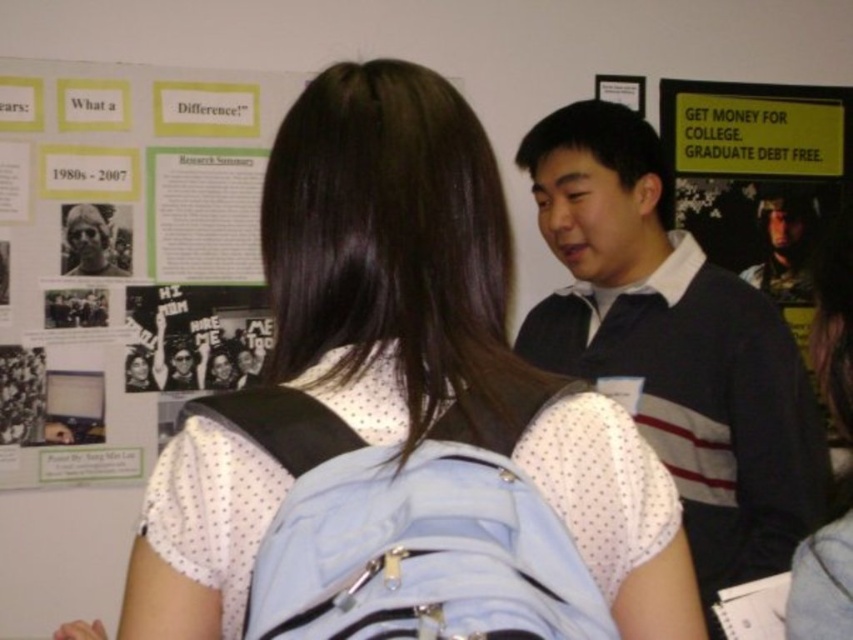
In the scene shown: Who is positioned more to the left, dark gray sweater at right or matte black hair at upper left?

matte black hair at upper left

Measure the distance from dark gray sweater at right to matte black hair at upper left.

dark gray sweater at right is 3.91 feet away from matte black hair at upper left.

Image resolution: width=853 pixels, height=640 pixels. Describe the element at coordinates (674, 346) in the screenshot. I see `dark gray sweater at right` at that location.

This screenshot has height=640, width=853. In order to click on dark gray sweater at right in this screenshot , I will do `click(674, 346)`.

Between matte black shirt at right and matte black hair at upper left, which one is positioned higher?

matte black shirt at right is above.

Is matte black shirt at right shorter than matte black hair at upper left?

In fact, matte black shirt at right may be taller than matte black hair at upper left.

Find the location of `matte black shirt at right`. matte black shirt at right is located at coordinates (784, 243).

Find the location of `matte black shirt at right`. matte black shirt at right is located at coordinates (784, 243).

Measure the distance from white paper poster at upper left to light blue fabric backpack at center.

1.51 meters

Does point (49, 182) come in front of point (567, 538)?

No, it is not.

In order to click on white paper poster at upper left in this screenshot , I will do `click(131, 257)`.